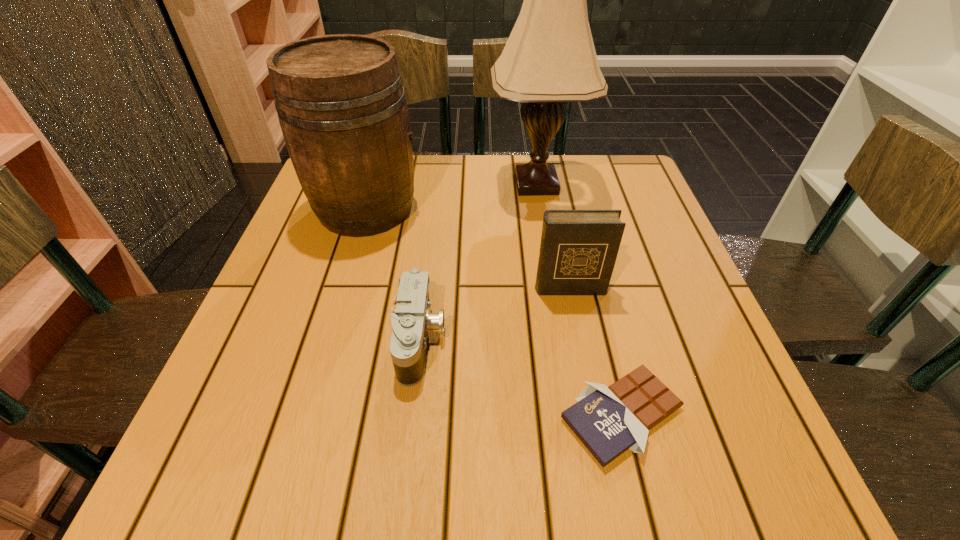
Where is `the tallest object`? Image resolution: width=960 pixels, height=540 pixels. the tallest object is located at coordinates (549, 59).

This screenshot has height=540, width=960. I want to click on the fourth shortest object, so click(340, 100).

In order to click on the third shortest object in this screenshot , I will do `click(578, 250)`.

The width and height of the screenshot is (960, 540). I want to click on the third nearest object, so click(x=578, y=250).

Find the location of `the second shortest object`. the second shortest object is located at coordinates (411, 319).

Image resolution: width=960 pixels, height=540 pixels. Find the location of `chocolate bar`. chocolate bar is located at coordinates (609, 420).

This screenshot has height=540, width=960. Identify the location of vacant space located 0.100m on the right of the lamp. (623, 184).

Identify the location of vacant space located 0.240m on the side of the cider near the bung hole. (520, 208).

You are a GUI agent. You are given a task and a screenshot of the screen. Output one action in this format:
    pyautogui.click(x=<x>, y=<y>)
    Task: Click on the vacant point located 0.300m on the front cover of the third shortest object
    Image resolution: width=960 pixels, height=540 pixels.
    Given the screenshot: What is the action you would take?
    pyautogui.click(x=600, y=444)

The height and width of the screenshot is (540, 960). Find the location of `vacant space located 0.240m on the lens of the fourth tallest object`. vacant space located 0.240m on the lens of the fourth tallest object is located at coordinates (578, 340).